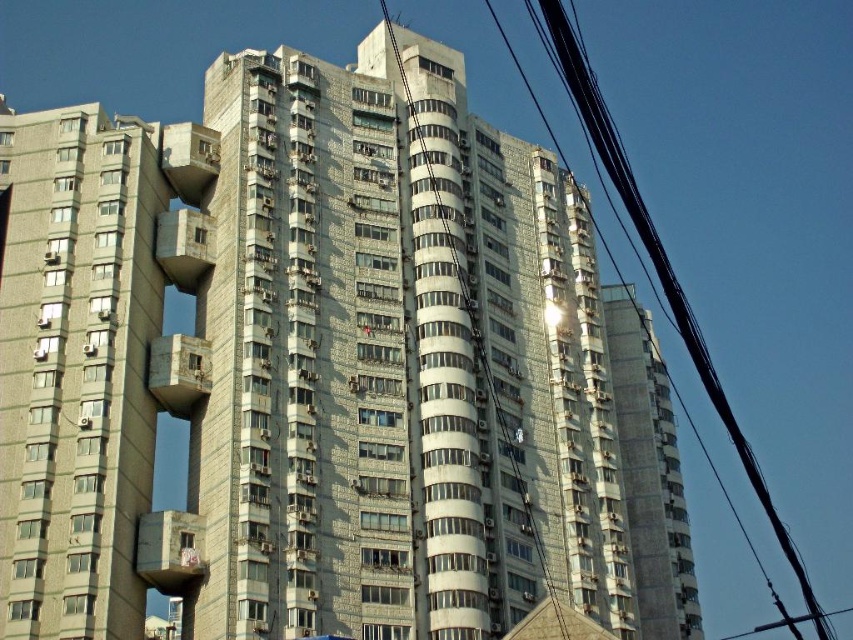
Who is shorter, black wire at upper right or metallic wire at center?

metallic wire at center

Between black wire at upper right and metallic wire at center, which one appears on the right side from the viewer's perspective?

Positioned to the right is black wire at upper right.

Locate an element on the screen. The image size is (853, 640). black wire at upper right is located at coordinates (663, 269).